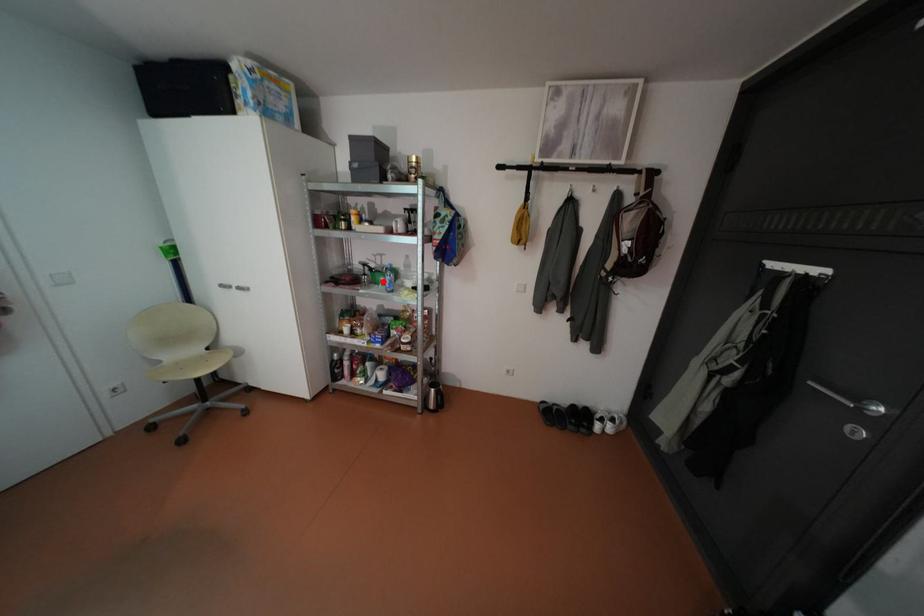
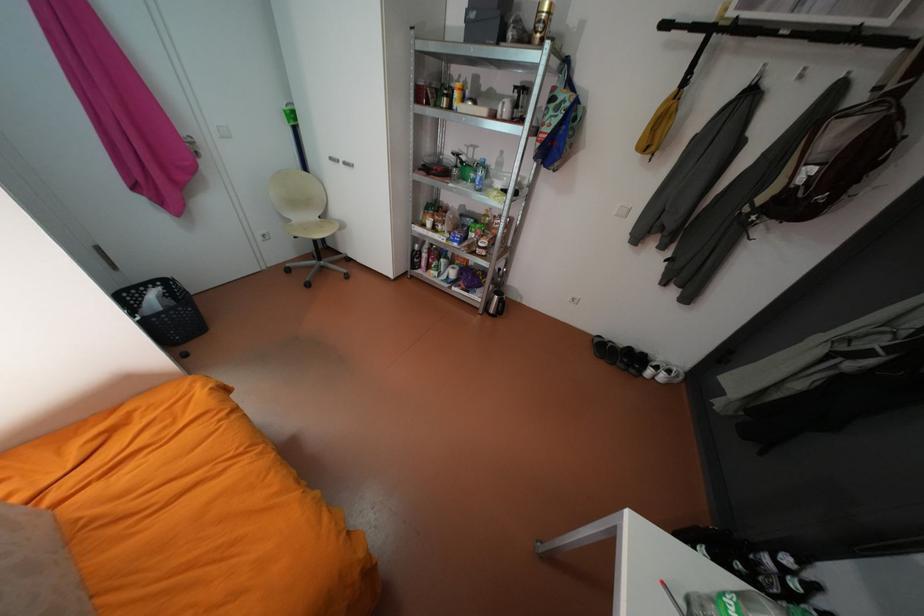
Question: I am providing you with two images of the same scene from different viewpoints. A red point is shown in image1. For the corresponding object point in image2, is it positioned nearer or farther from the camera?

Choices:
 (A) Nearer
 (B) Farther

Answer: (A)